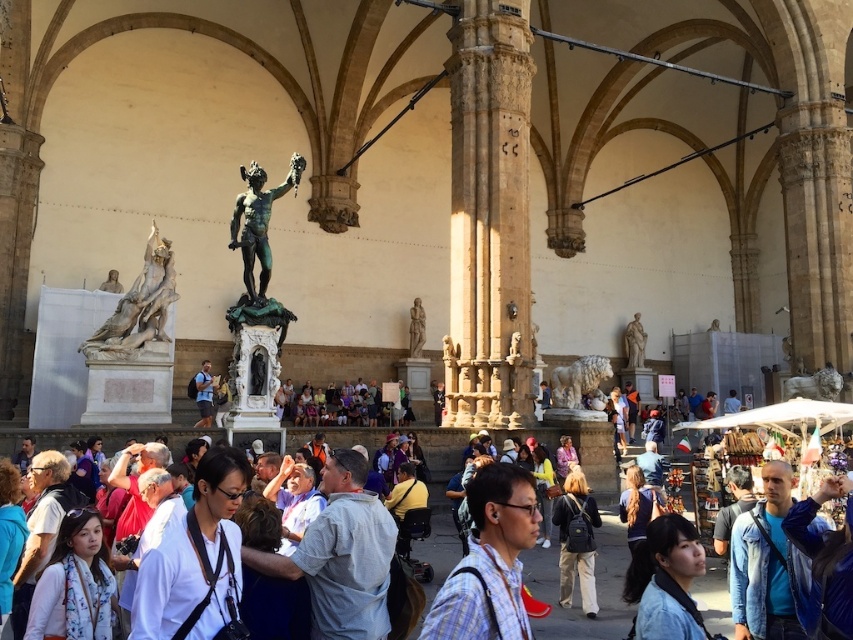
You are standing in the grand historic building and notice the white marble statue at left. Based on its coordinates, can you determine if it is positioned closer to the left edge or the right edge of the space?

The white marble statue at left is located at point 0.480 on the x and 0.163 on the y, so it is positioned closer to the left edge of the space since the x coordinate is less than 0.5.

You are standing in the grand historic building and want to reach the point marked as point [479,518]. Considering the crowd density described, do you think you can easily navigate to that point?

The point [479,518] is 23.21 meters away from you. However, the crowd density is described as dense, so it might be challenging to navigate through the crowd to reach that point easily.

You are standing in the grand building and want to take a photo of the white marble statue at left without any people blocking the view. Since the khaki pants at center is in the way, where should you move to get a clear shot?

The white marble statue at left is to the left of khaki pants at center, so you should move to the left side of the khaki pants at center to avoid the obstruction and capture the statue clearly.